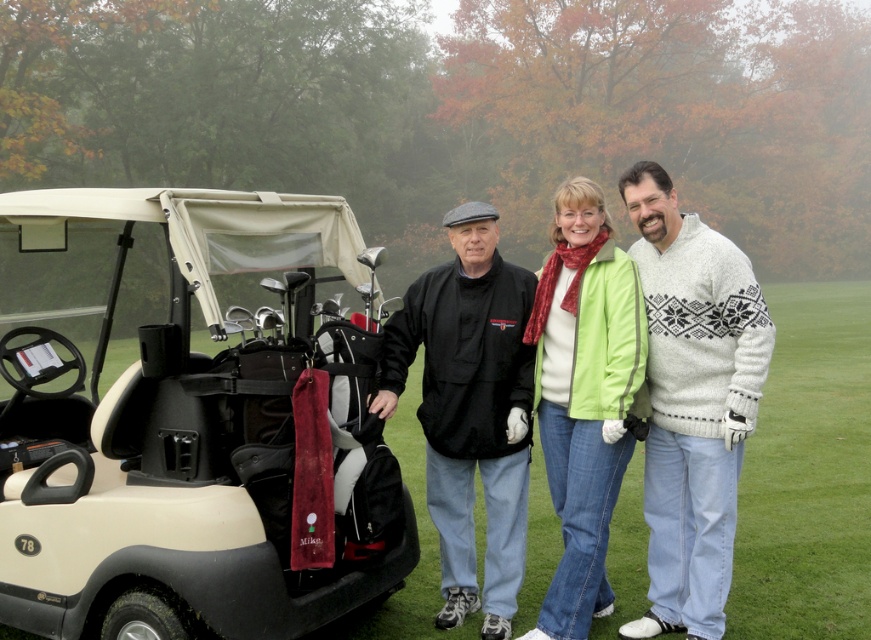
Question: Which point is farther to the camera?

Choices:
 (A) (46, 241)
 (B) (726, 570)
 (C) (436, 392)
 (D) (598, 369)

Answer: (A)

Question: Does beige matte golf cart at left have a smaller size compared to green fabric jacket at center?

Choices:
 (A) yes
 (B) no

Answer: (B)

Question: Can you confirm if beige matte golf cart at left is bigger than black matte jacket at center?

Choices:
 (A) no
 (B) yes

Answer: (B)

Question: Which object is farther from the camera taking this photo?

Choices:
 (A) white knitted sweater at center
 (B) beige matte golf cart at left
 (C) black matte jacket at center

Answer: (C)

Question: Among these objects, which one is farthest from the camera?

Choices:
 (A) white knitted sweater at center
 (B) black matte jacket at center
 (C) green matte jacket at center

Answer: (B)

Question: Is green fabric jacket at center bigger than black matte jacket at center?

Choices:
 (A) no
 (B) yes

Answer: (B)